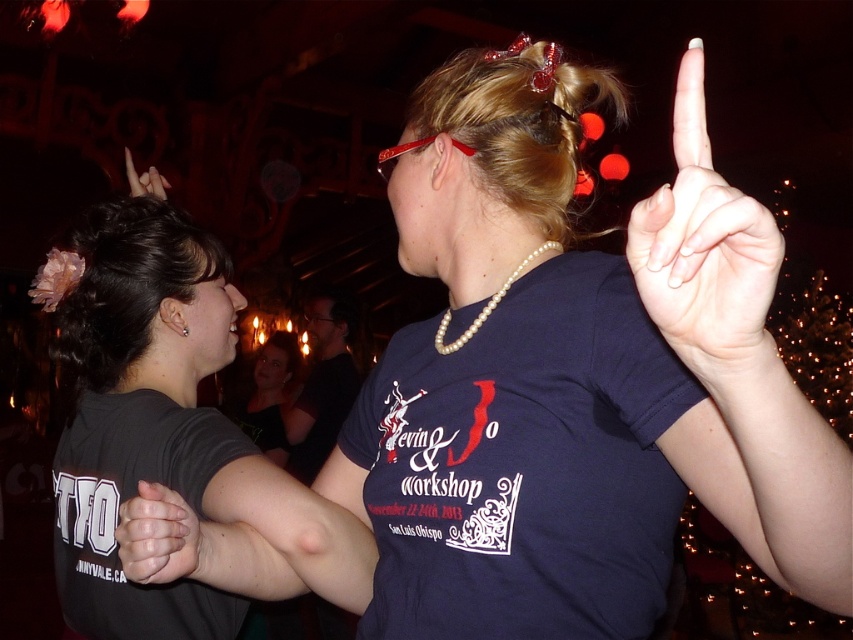
Which of these two, navy blue t-shirt at upper center or matte black hand at upper left, stands taller?

With more height is navy blue t-shirt at upper center.

Who is more forward, (592, 371) or (134, 172)?

Point (592, 371)

Describe the element at coordinates (524, 465) in the screenshot. Image resolution: width=853 pixels, height=640 pixels. I see `navy blue t-shirt at upper center` at that location.

The image size is (853, 640). Find the location of `navy blue t-shirt at upper center`. navy blue t-shirt at upper center is located at coordinates (524, 465).

Between navy blue t-shirt at upper center and pearl necklace at center, which one is positioned lower?

Positioned lower is navy blue t-shirt at upper center.

Can you confirm if navy blue t-shirt at upper center is bigger than pearl necklace at center?

Yes.

Between point (573, 616) and point (444, 337), which one is positioned behind?

Positioned behind is point (444, 337).

This screenshot has height=640, width=853. What are the coordinates of `navy blue t-shirt at upper center` in the screenshot? It's located at (524, 465).

Is navy blue t-shirt at upper center wider than matte black shirt at center?

In fact, navy blue t-shirt at upper center might be narrower than matte black shirt at center.

Can you confirm if navy blue t-shirt at upper center is positioned to the left of matte black shirt at center?

No, navy blue t-shirt at upper center is not to the left of matte black shirt at center.

Image resolution: width=853 pixels, height=640 pixels. In order to click on navy blue t-shirt at upper center in this screenshot , I will do `click(524, 465)`.